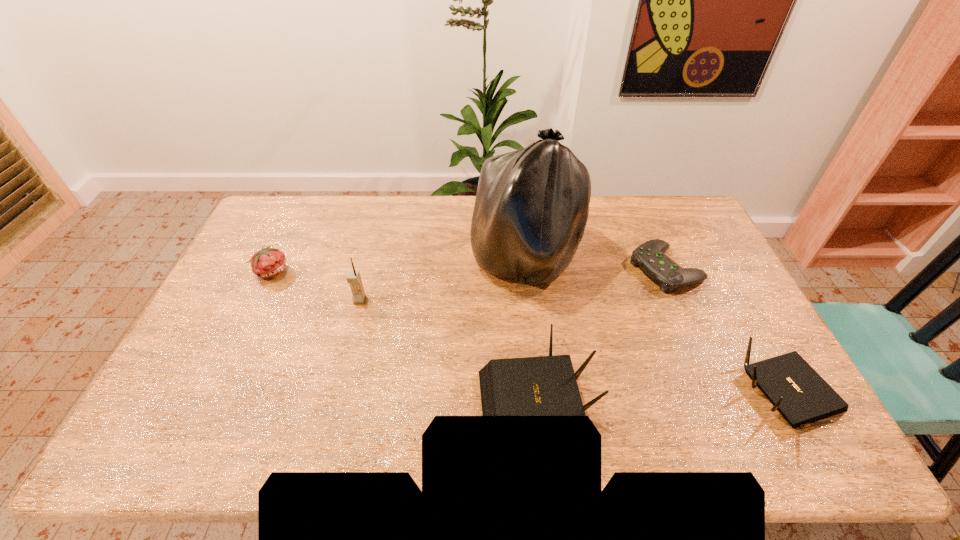
Image resolution: width=960 pixels, height=540 pixels. Find the location of `vacant space that satisfies the following two spatial constraints: 1. on the front side of the plastic bag; 2. on the right side of the shorter router`. vacant space that satisfies the following two spatial constraints: 1. on the front side of the plastic bag; 2. on the right side of the shorter router is located at coordinates (541, 397).

The height and width of the screenshot is (540, 960). Identify the location of free spot that satisfies the following two spatial constraints: 1. on the front side of the fifth tallest object; 2. on the left side of the right router. (212, 397).